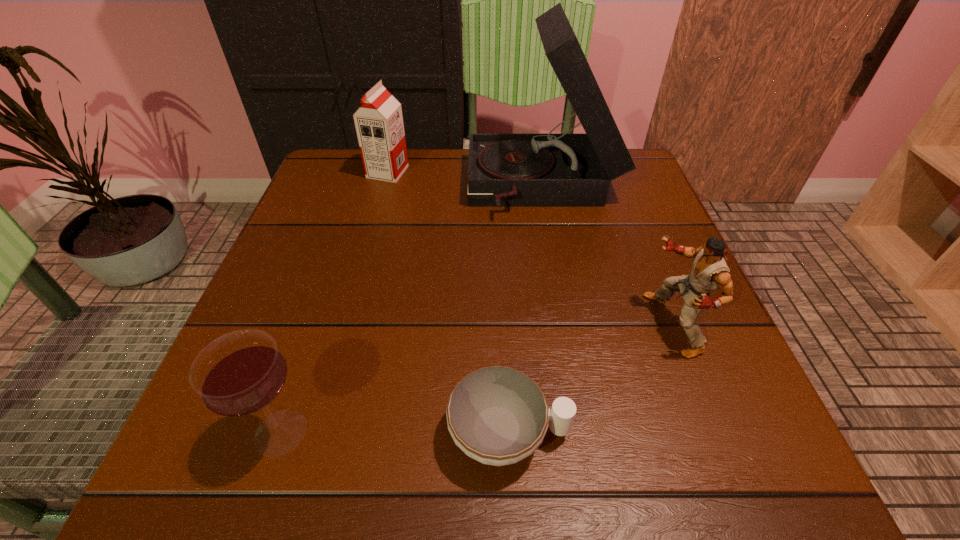
You are a GUI agent. You are given a task and a screenshot of the screen. Output one action in this format:
    pyautogui.click(x=<x>, y=<y>)
    Task: Click on the vacant area at the far right corner of the desktop
    
    Given the screenshot: What is the action you would take?
    pyautogui.click(x=647, y=203)

Where is `vacant region at the near right corner`? vacant region at the near right corner is located at coordinates (680, 492).

You are a GUI agent. You are given a task and a screenshot of the screen. Output one action in this format:
    pyautogui.click(x=<x>, y=<y>)
    Task: Click on the vacant space in between the tallest object and the puncher
    This screenshot has height=540, width=960.
    Given the screenshot: What is the action you would take?
    608,256

Locate an element on the screen. The image size is (960, 540). vacant area that lies between the soya milk and the shortest object is located at coordinates (448, 303).

Find the location of a particular element. free space that is in between the phonograph_record and the soya milk is located at coordinates (466, 180).

What are the coordinates of `free space between the soya milk and the puncher` in the screenshot? It's located at (530, 248).

This screenshot has width=960, height=540. Find the location of `free spot between the tallest object and the wineglass`. free spot between the tallest object and the wineglass is located at coordinates (412, 310).

You are a GUI agent. You are given a task and a screenshot of the screen. Output one action in this format:
    pyautogui.click(x=<x>, y=<y>)
    Task: Click on the vacant area between the third farthest object and the shortest object
    Image resolution: width=960 pixels, height=540 pixels.
    Given the screenshot: What is the action you would take?
    pyautogui.click(x=590, y=379)

I want to click on vacant region between the soya milk and the wineglass, so click(334, 302).

Where is `empty space between the shortest object and the wineglass`? Image resolution: width=960 pixels, height=540 pixels. empty space between the shortest object and the wineglass is located at coordinates (395, 433).